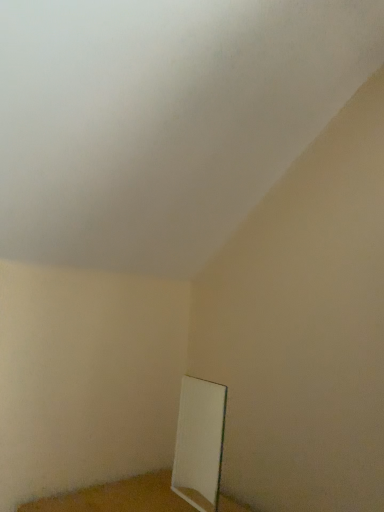
What are the coordinates of `white glossy mirror at lower center` in the screenshot? It's located at (199, 443).

This screenshot has height=512, width=384. Describe the element at coordinates (199, 443) in the screenshot. I see `white glossy mirror at lower center` at that location.

Locate an element on the screen. white glossy mirror at lower center is located at coordinates (199, 443).